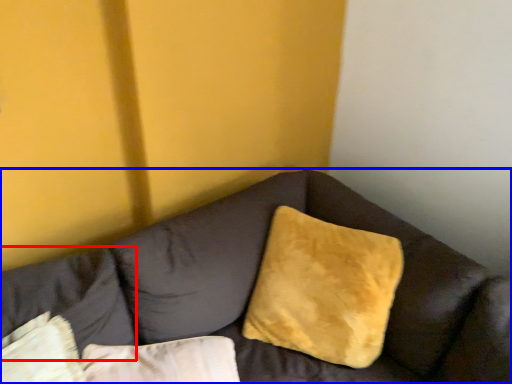
Question: Which object is closer to the camera taking this photo, pillow (highlighted by a red box) or studio couch (highlighted by a blue box)?

Choices:
 (A) pillow
 (B) studio couch

Answer: (B)